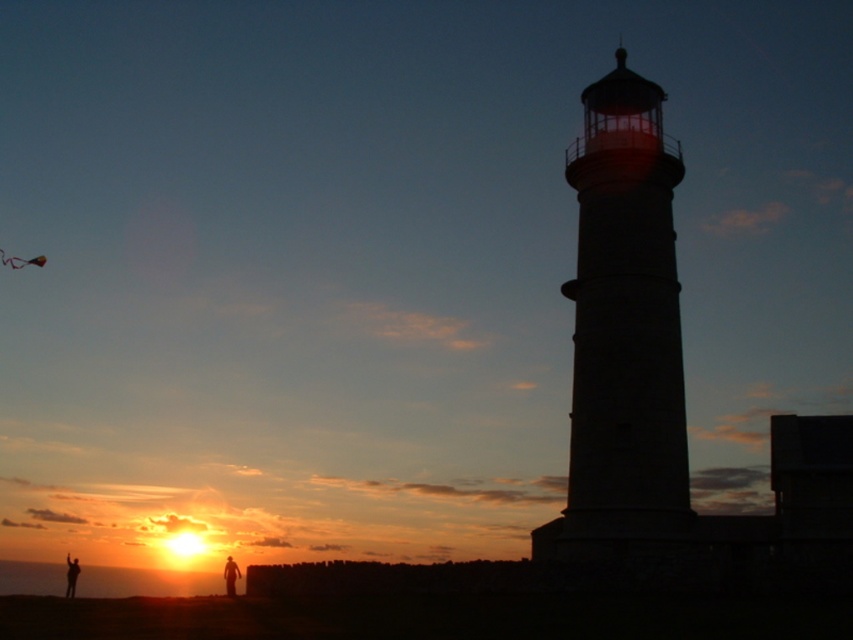
Does white stone tower at center come behind silhouette figure at lower left?

No.

Where is `white stone tower at center`? This screenshot has width=853, height=640. white stone tower at center is located at coordinates (624, 330).

Who is lower down, white stone tower at center or multicolored fabric kite at upper left?

white stone tower at center is below.

Does white stone tower at center have a lesser height compared to multicolored fabric kite at upper left?

In fact, white stone tower at center may be taller than multicolored fabric kite at upper left.

Who is more distant from viewer, (660, 189) or (33, 259)?

The point (33, 259) is more distant.

Image resolution: width=853 pixels, height=640 pixels. Identify the location of white stone tower at center. (624, 330).

Does multicolored fabric kite at upper left have a greater width compared to silhouette figure at lower left?

No.

Who is positioned more to the left, multicolored fabric kite at upper left or silhouette figure at lower left?

From the viewer's perspective, multicolored fabric kite at upper left appears more on the left side.

Identify the location of multicolored fabric kite at upper left. This screenshot has width=853, height=640. (20, 260).